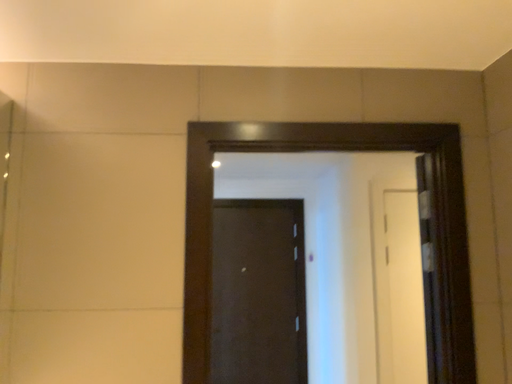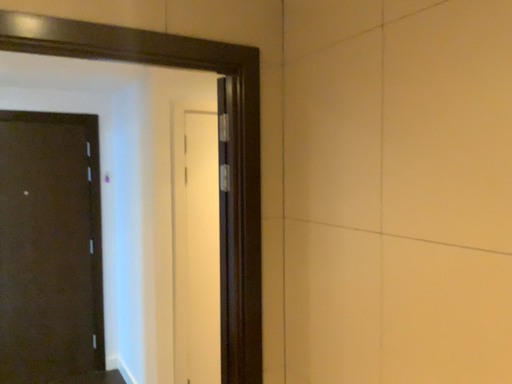
Question: Which way did the camera rotate in the video?

Choices:
 (A) rotated upward
 (B) rotated downward

Answer: (B)